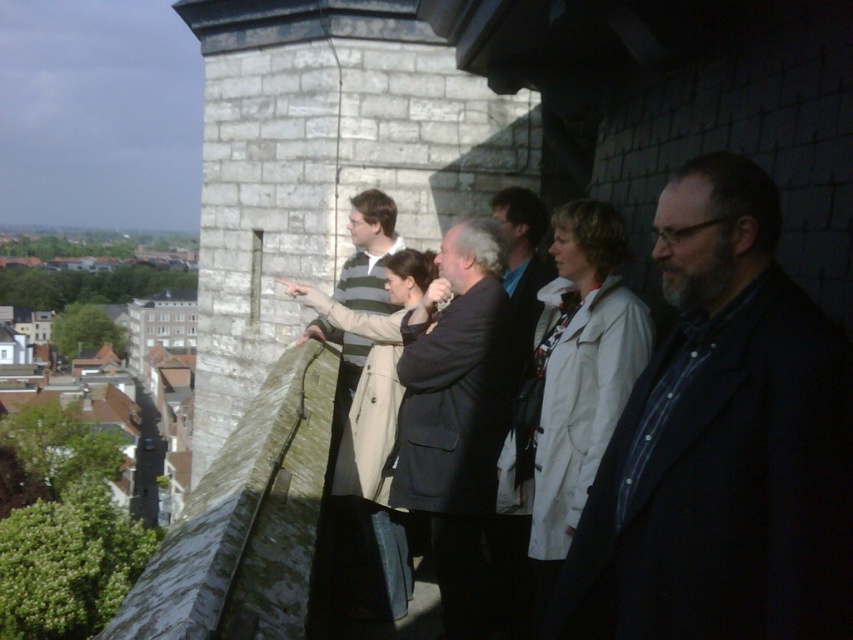
Which is more to the left, dark blue shirt at center or striped knit sweater at center?

Positioned to the left is striped knit sweater at center.

Is point (682, 330) positioned in front of point (389, 241)?

Yes, point (682, 330) is closer to viewer.

This screenshot has width=853, height=640. I want to click on dark blue shirt at center, so click(x=722, y=444).

Is point (465, 296) behind point (357, 532)?

That is False.

Is point (463, 429) closer to camera compared to point (376, 602)?

That is True.

Between point (399, 419) and point (386, 244), which one is positioned in front?

Positioned in front is point (399, 419).

Where is `dark gray wool coat at center`? dark gray wool coat at center is located at coordinates (456, 412).

Is dark blue shirt at center further to camera compared to dark gray wool coat at center?

No, dark blue shirt at center is closer to the viewer.

Who is higher up, dark blue shirt at center or dark gray wool coat at center?

dark blue shirt at center is above.

Who is more forward, [627,508] or [485,353]?

Point [627,508] is in front.

Find the location of a particular element. dark blue shirt at center is located at coordinates (722, 444).